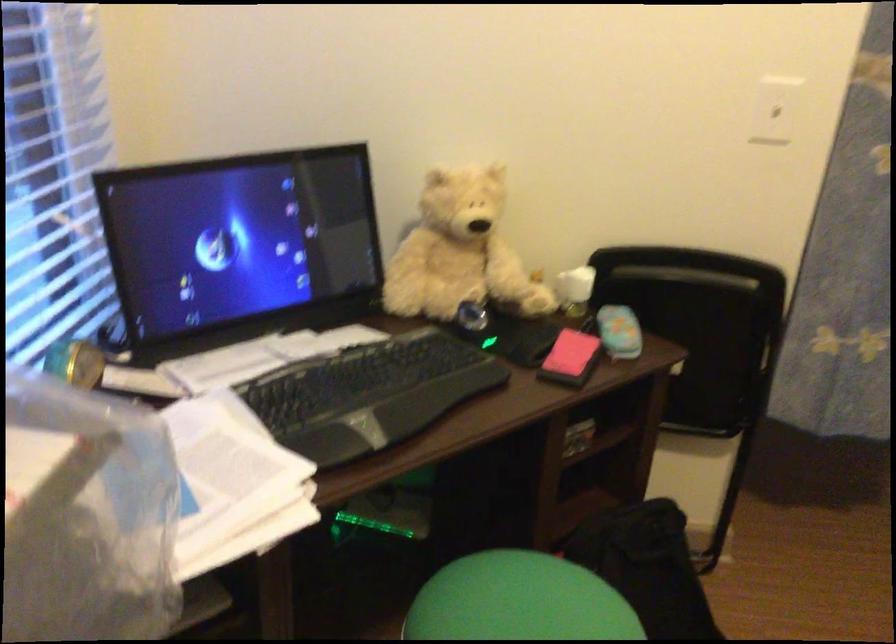
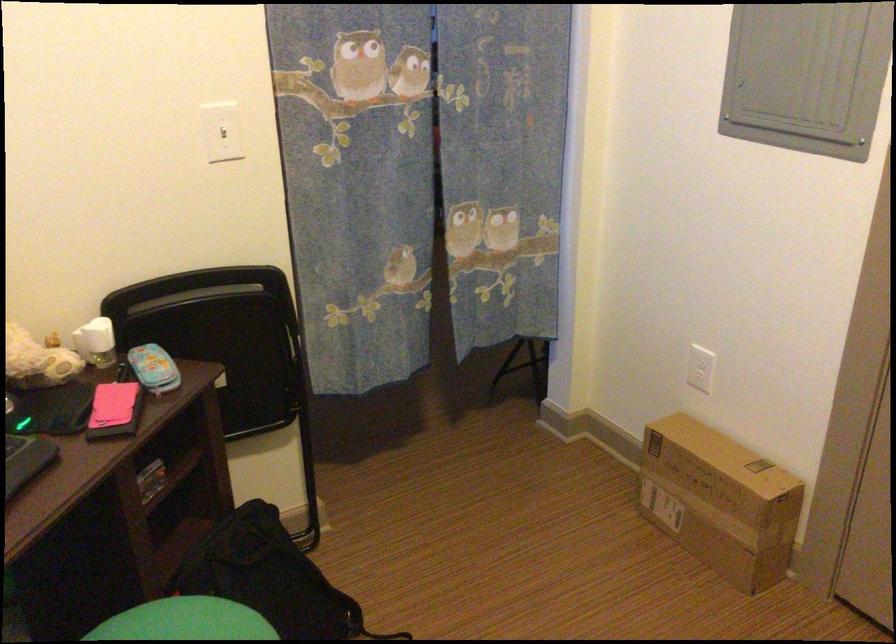
In the second image, find the point that corresponds to the point at 781,104 in the first image.

(222, 131)